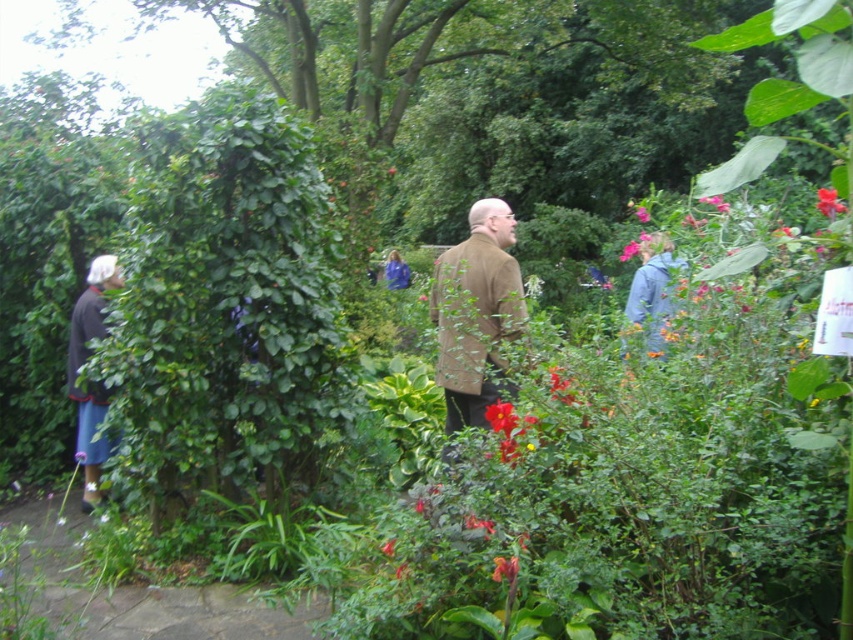
Question: Does stone paved path at lower left appear on the left side of pink matte flower at center?

Choices:
 (A) yes
 (B) no

Answer: (A)

Question: Which is farther from the stone paved path at lower left?

Choices:
 (A) green leafy bush at left
 (B) pink matte flower at upper right
 (C) blue fleece jacket at upper right
 (D) vivid red petals at center

Answer: (B)

Question: Considering the relative positions of blue fleece jacket at upper right and pink matte flower at center in the image provided, where is blue fleece jacket at upper right located with respect to pink matte flower at center?

Choices:
 (A) left
 (B) right

Answer: (A)

Question: Can you confirm if vivid red petals at center is bigger than pink matte flower at center?

Choices:
 (A) no
 (B) yes

Answer: (A)

Question: Which object is farther from the camera taking this photo?

Choices:
 (A) red matte flower at center
 (B) bright pink petals at center
 (C) vivid red petals at center

Answer: (B)

Question: Which point is farther from the camera taking this photo?

Choices:
 (A) (97, 444)
 (B) (390, 269)

Answer: (B)